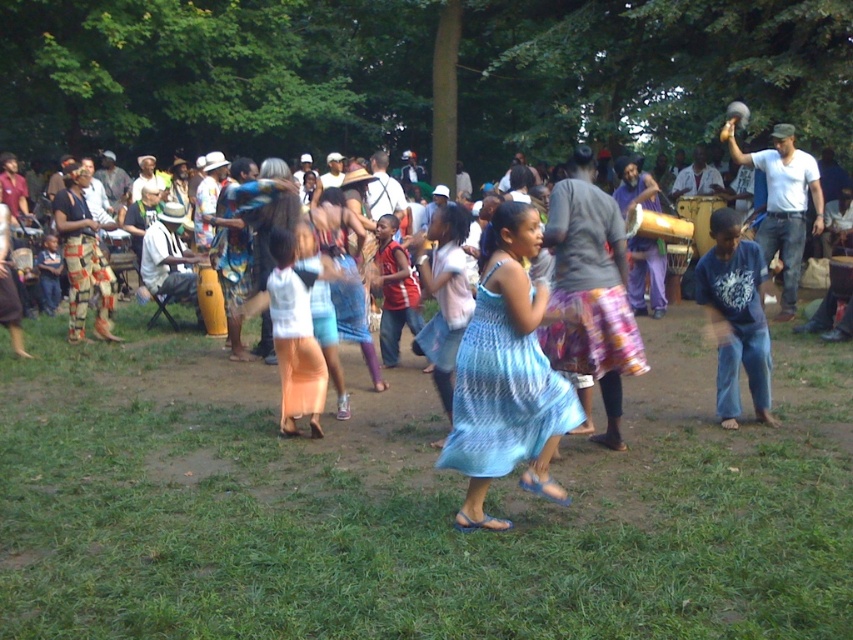
Who is lower down, green grass at center or light orange fabric skirt at center?

green grass at center is below.

Identify the location of green grass at center. Image resolution: width=853 pixels, height=640 pixels. (408, 508).

Find the location of a particular element. green grass at center is located at coordinates (408, 508).

Based on the photo, is the position of green grass at center more distant than that of blue knitted dress at center?

No.

In the scene shown: Which is more to the right, green grass at center or blue knitted dress at center?

green grass at center is more to the right.

Which is behind, point (111, 618) or point (474, 349)?

The point (474, 349) is behind.

This screenshot has height=640, width=853. In order to click on green grass at center in this screenshot , I will do `click(408, 508)`.

Is blue knitted dress at center to the right of light orange fabric skirt at center from the viewer's perspective?

Indeed, blue knitted dress at center is positioned on the right side of light orange fabric skirt at center.

Is blue knitted dress at center positioned at the back of light orange fabric skirt at center?

That is False.

In order to click on blue knitted dress at center in this screenshot , I will do `click(502, 392)`.